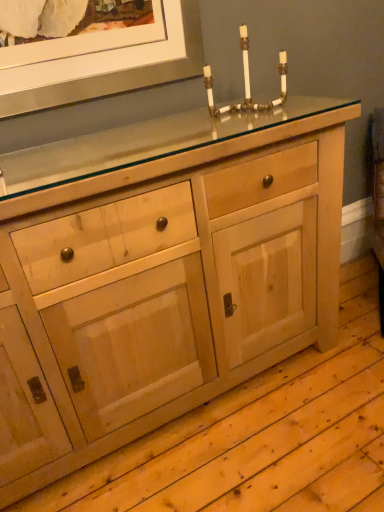
Image resolution: width=384 pixels, height=512 pixels. Find the location of `white ceramic candle holder at upper center`. white ceramic candle holder at upper center is located at coordinates (246, 83).

Describe the element at coordinates (246, 83) in the screenshot. I see `white ceramic candle holder at upper center` at that location.

Where is `white ceramic candle holder at upper center`? white ceramic candle holder at upper center is located at coordinates (246, 83).